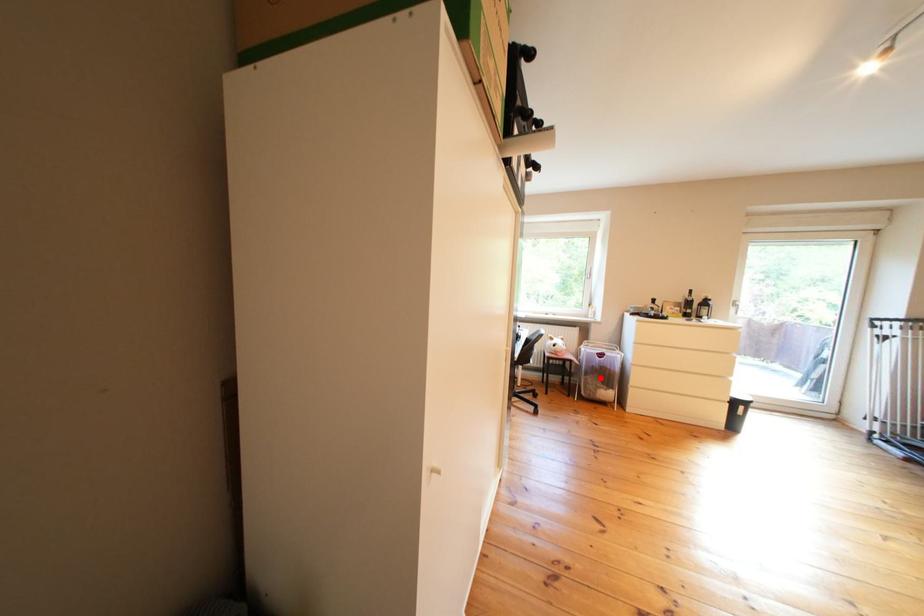
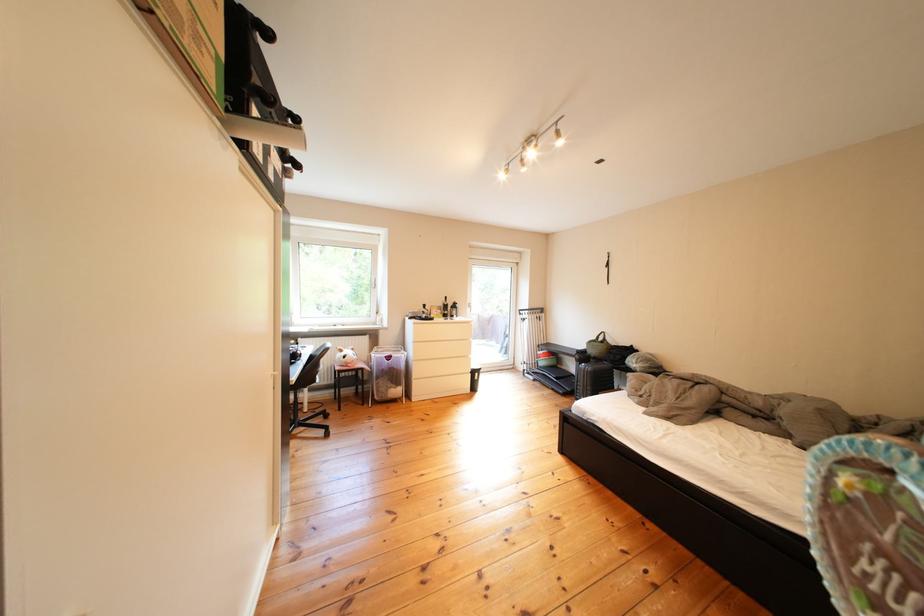
Locate, in the second image, the point that corresponds to the highlighted location in the first image.

(392, 382)